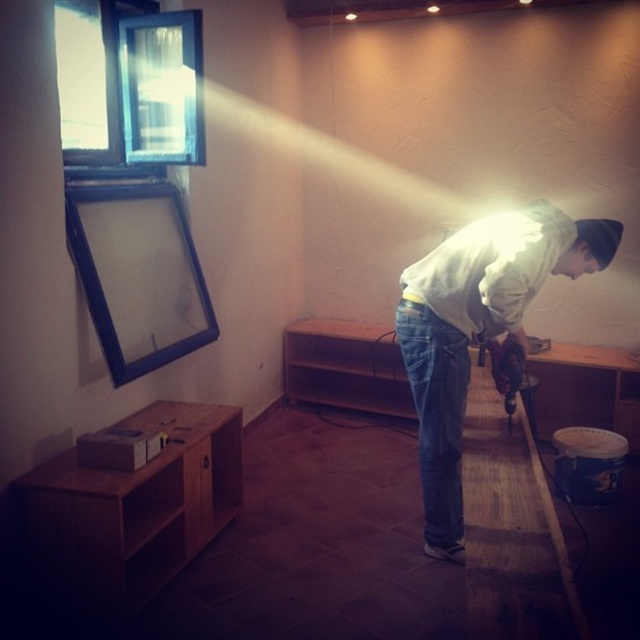
You are a contractor assessing the renovation site. You notice the white matte shirt at center and the metallic drill at lower center. Which object is wider?

The white matte shirt at center is wider than the metallic drill at lower center.

You are standing in the room and want to locate the white matte shirt at center. According to the coordinates provided, where should you look?

The white matte shirt at center is located at coordinates point (477, 330).

You are a contractor working in this room and need to determine if the white matte shirt at center can be folded and stored in a drawer designed for the metallic drill at lower center. Based on their sizes, what would you conclude?

The white matte shirt at center is larger in size than the metallic drill at lower center, so it may not fit into the drawer designed for the metallic drill at lower center unless the shirt is folded sufficiently to reduce its size.